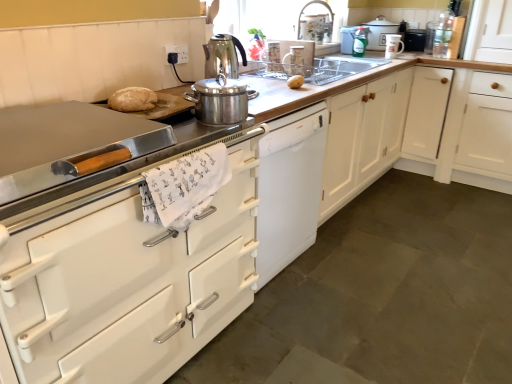
Question: Are green glossy spray bottle at upper center, the fifth kitchen appliance viewed from the front, and white ceramic mug at upper right, the 3th kitchen appliance from the back, located far from each other?

Choices:
 (A) no
 (B) yes

Answer: (A)

Question: From the image's perspective, does green glossy spray bottle at upper center, which appears as the 2th kitchen appliance when viewed from the back, appear higher than white ceramic mug at upper right, acting as the fourth kitchen appliance starting from the front?

Choices:
 (A) no
 (B) yes

Answer: (B)

Question: Considering the relative positions of green glossy spray bottle at upper center, arranged as the fourth kitchen appliance when viewed from the left, and white ceramic mug at upper right, the fifth kitchen appliance in the left-to-right sequence, in the image provided, is green glossy spray bottle at upper center, arranged as the fourth kitchen appliance when viewed from the left, behind white ceramic mug at upper right, the fifth kitchen appliance in the left-to-right sequence,?

Choices:
 (A) yes
 (B) no

Answer: (A)

Question: Considering the relative sizes of green glossy spray bottle at upper center, the third kitchen appliance from the right, and white ceramic mug at upper right, acting as the fourth kitchen appliance starting from the front, in the image provided, is green glossy spray bottle at upper center, the third kitchen appliance from the right, bigger than white ceramic mug at upper right, acting as the fourth kitchen appliance starting from the front,?

Choices:
 (A) no
 (B) yes

Answer: (A)

Question: Could you tell me if green glossy spray bottle at upper center, the fifth kitchen appliance viewed from the front, is turned towards white ceramic mug at upper right, placed as the 2th kitchen appliance when sorted from right to left?

Choices:
 (A) yes
 (B) no

Answer: (B)

Question: Considering the positions of point (413, 39) and point (389, 112), is point (413, 39) closer or farther from the camera than point (389, 112)?

Choices:
 (A) farther
 (B) closer

Answer: (A)

Question: From the image's perspective, relative to white wood cabinet at right, which is the 1th cabinetry from back to front, is black matte microwave at upper right, the first appliance positioned from the back, above or below?

Choices:
 (A) above
 (B) below

Answer: (A)

Question: Which is correct: black matte microwave at upper right, marked as the 2th appliance in a front-to-back arrangement, is inside white wood cabinet at right, which is the 1th cabinetry from back to front, or outside of it?

Choices:
 (A) outside
 (B) inside

Answer: (A)

Question: In terms of width, does black matte microwave at upper right, the first appliance positioned from the back, look wider or thinner when compared to white wood cabinet at right, placed as the 1th cabinetry when sorted from right to left?

Choices:
 (A) wide
 (B) thin

Answer: (B)

Question: Is white ceramic crock pot at upper center, positioned as the first kitchen appliance in back-to-front order, situated inside metallic faucet at upper center or outside?

Choices:
 (A) outside
 (B) inside

Answer: (A)

Question: Is white ceramic crock pot at upper center, which is the 6th kitchen appliance from front to back, in front of or behind metallic faucet at upper center in the image?

Choices:
 (A) behind
 (B) front

Answer: (A)

Question: From the image's perspective, is white ceramic crock pot at upper center, which is the 6th kitchen appliance from front to back, positioned above or below metallic faucet at upper center?

Choices:
 (A) above
 (B) below

Answer: (A)

Question: Visually, is white ceramic crock pot at upper center, the 1th kitchen appliance in the right-to-left sequence, positioned to the left or to the right of metallic faucet at upper center?

Choices:
 (A) right
 (B) left

Answer: (A)

Question: In the image, is metallic faucet at upper center positioned in front of or behind white wood cabinet at right, which is the 1th cabinetry from back to front?

Choices:
 (A) front
 (B) behind

Answer: (A)

Question: From the image's perspective, is metallic faucet at upper center above or below white wood cabinet at right, which appears as the 2th cabinetry when viewed from the front?

Choices:
 (A) below
 (B) above

Answer: (B)